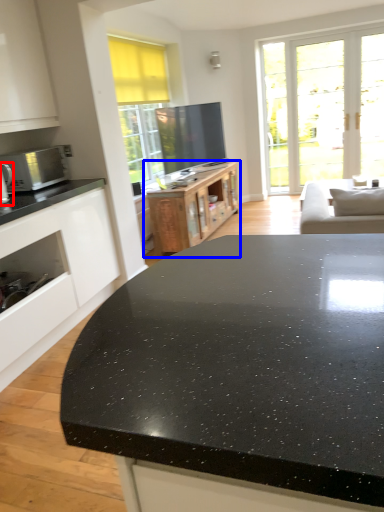
Question: Which of the following is the farthest to the observer, appliance (highlighted by a red box) or cabinetry (highlighted by a blue box)?

Choices:
 (A) appliance
 (B) cabinetry

Answer: (B)